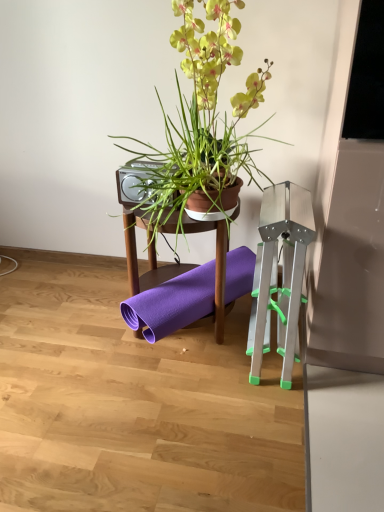
Locate an element on the screen. Image resolution: width=384 pixels, height=512 pixels. free space in front of metallic silver easel at right is located at coordinates (283, 417).